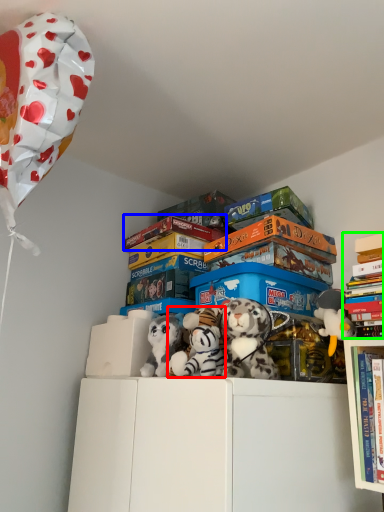
Question: Estimate the real-world distances between objects in this image. Which object is closer to toy (highlighted by a red box), book (highlighted by a blue box) or book (highlighted by a green box)?

Choices:
 (A) book
 (B) book

Answer: (B)